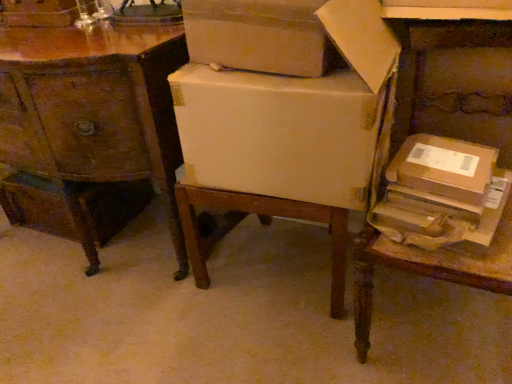
Locate an element on the screen. The height and width of the screenshot is (384, 512). free location in front of wooden desk at center is located at coordinates (90, 318).